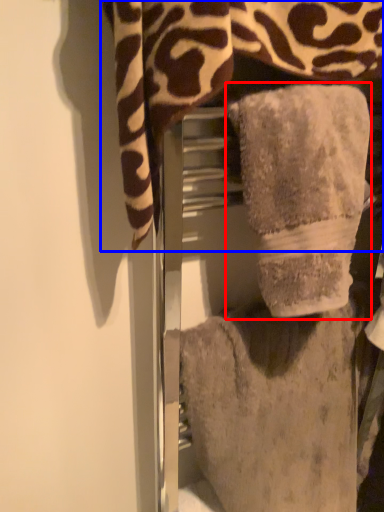
Question: Which object appears closest to the camera in this image, towel (highlighted by a red box) or towel (highlighted by a blue box)?

Choices:
 (A) towel
 (B) towel

Answer: (B)